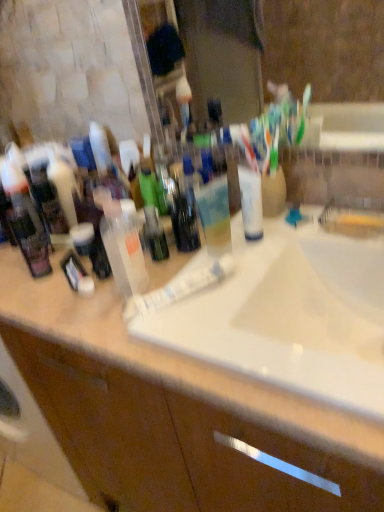
This screenshot has width=384, height=512. Identify the location of vacant space to the left of white glossy tube at center. (96, 315).